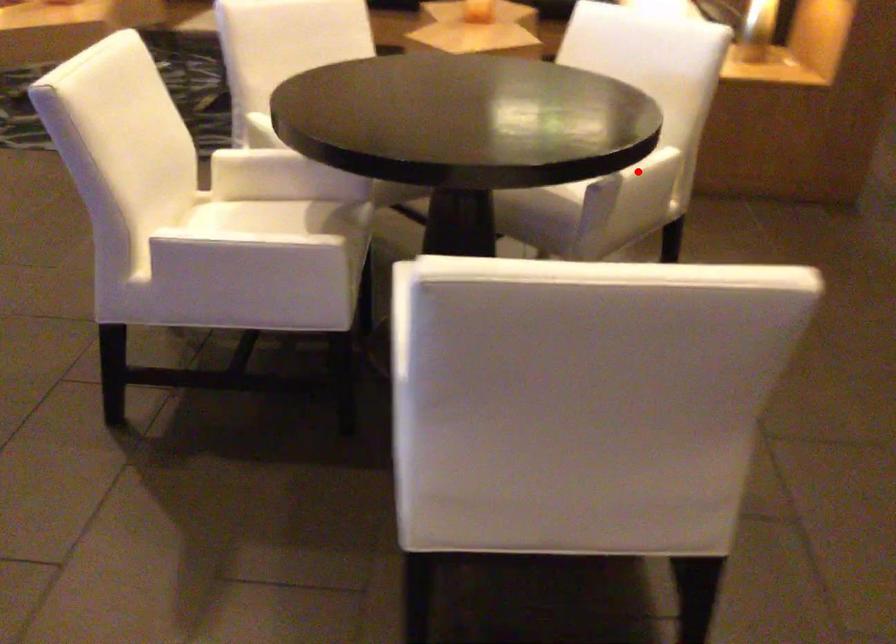
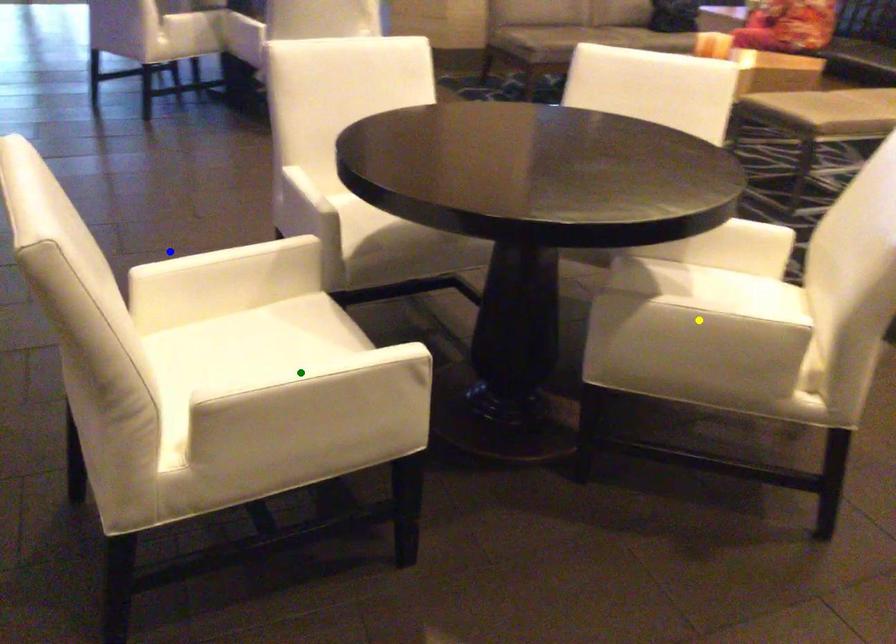
Question: I am providing you with two images of the same scene from different viewpoints. A red point is marked on the first image. You are given multiple points on the second image. Which spot in image 2 lines up with the point in image 1?

Choices:
 (A) green point
 (B) blue point
 (C) yellow point

Answer: (C)